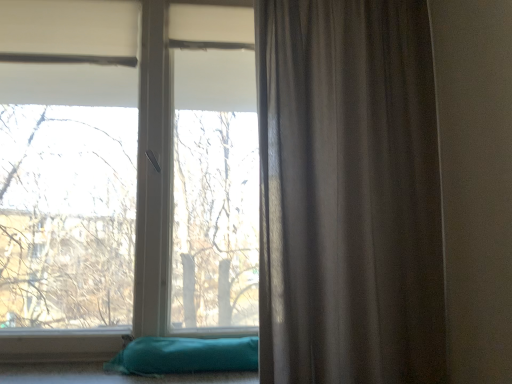
In order to click on teal fabric pillow at lower left in this screenshot , I will do `click(185, 356)`.

Image resolution: width=512 pixels, height=384 pixels. What are the coordinates of `transparent glass window at center` in the screenshot? It's located at (125, 175).

This screenshot has height=384, width=512. Describe the element at coordinates (348, 194) in the screenshot. I see `satin gray curtain at right` at that location.

Locate an element on the screen. This screenshot has height=384, width=512. teal fabric pillow at lower left is located at coordinates (185, 356).

Considering the relative positions of transparent glass window at center and teal fabric pillow at lower left in the image provided, is transparent glass window at center behind teal fabric pillow at lower left?

Yes.

Is teal fabric pillow at lower left at the back of transparent glass window at center?

No, transparent glass window at center is not facing away from teal fabric pillow at lower left.

From a real-world perspective, between transparent glass window at center and teal fabric pillow at lower left, who is vertically lower?

teal fabric pillow at lower left, from a real-world perspective.

From the image's perspective, who appears lower, transparent glass window at center or teal fabric pillow at lower left?

From the image's view, teal fabric pillow at lower left is below.

The width and height of the screenshot is (512, 384). I want to click on window that appears above the satin gray curtain at right (from a real-world perspective), so tap(125, 175).

From a real-world perspective, who is located higher, transparent glass window at center or satin gray curtain at right?

transparent glass window at center.

Choose the correct answer: Is transparent glass window at center inside satin gray curtain at right or outside it?

transparent glass window at center is spatially situated outside satin gray curtain at right.

Is satin gray curtain at right shorter than teal fabric pillow at lower left?

In fact, satin gray curtain at right may be taller than teal fabric pillow at lower left.

From the image's perspective, who appears lower, satin gray curtain at right or teal fabric pillow at lower left?

teal fabric pillow at lower left.

Which is behind, point (405, 97) or point (155, 355)?

The point (155, 355) is behind.

Can you tell me how much satin gray curtain at right and transparent glass window at center differ in facing direction?

1.38 degrees.

From the image's perspective, is satin gray curtain at right located above or below transparent glass window at center?

Based on their image positions, satin gray curtain at right is located beneath transparent glass window at center.

From the picture: Does satin gray curtain at right come in front of transparent glass window at center?

That is True.

Which of these two, satin gray curtain at right or transparent glass window at center, is smaller?

satin gray curtain at right is smaller.

Does teal fabric pillow at lower left lie behind satin gray curtain at right?

Yes, teal fabric pillow at lower left is further from the camera.

Is there a large distance between teal fabric pillow at lower left and satin gray curtain at right?

No, there isn't a large distance between teal fabric pillow at lower left and satin gray curtain at right.

Is teal fabric pillow at lower left bigger than satin gray curtain at right?

Incorrect, teal fabric pillow at lower left is not larger than satin gray curtain at right.

Is teal fabric pillow at lower left inside or outside of transparent glass window at center?

teal fabric pillow at lower left cannot be found inside transparent glass window at center.

Which object is thinner, teal fabric pillow at lower left or transparent glass window at center?

transparent glass window at center.

Are teal fabric pillow at lower left and transparent glass window at center making contact?

No, teal fabric pillow at lower left is not making contact with transparent glass window at center.

Is teal fabric pillow at lower left oriented towards transparent glass window at center?

No, teal fabric pillow at lower left is not facing towards transparent glass window at center.

This screenshot has width=512, height=384. Identify the location of window on the left of teal fabric pillow at lower left. (125, 175).

Where is `curtain that is on the right side of transparent glass window at center`? The height and width of the screenshot is (384, 512). curtain that is on the right side of transparent glass window at center is located at coordinates (348, 194).

When comparing their distances from teal fabric pillow at lower left, does satin gray curtain at right or transparent glass window at center seem closer?

Based on the image, satin gray curtain at right appears to be nearer to teal fabric pillow at lower left.

Based on their spatial positions, is teal fabric pillow at lower left or transparent glass window at center closer to satin gray curtain at right?

teal fabric pillow at lower left is closer to satin gray curtain at right.

Based on their spatial positions, is transparent glass window at center or teal fabric pillow at lower left closer to satin gray curtain at right?

teal fabric pillow at lower left is closer to satin gray curtain at right.

Based on their spatial positions, is teal fabric pillow at lower left or satin gray curtain at right closer to transparent glass window at center?

teal fabric pillow at lower left.

Based on the photo, estimate the real-world distances between objects in this image. Which object is closer to teal fabric pillow at lower left, transparent glass window at center or satin gray curtain at right?

satin gray curtain at right.

Looking at the image, which one is located closer to transparent glass window at center, satin gray curtain at right or teal fabric pillow at lower left?

teal fabric pillow at lower left is positioned closer to the anchor transparent glass window at center.

Where is `pillow between transparent glass window at center and satin gray curtain at right`? This screenshot has height=384, width=512. pillow between transparent glass window at center and satin gray curtain at right is located at coordinates (185, 356).